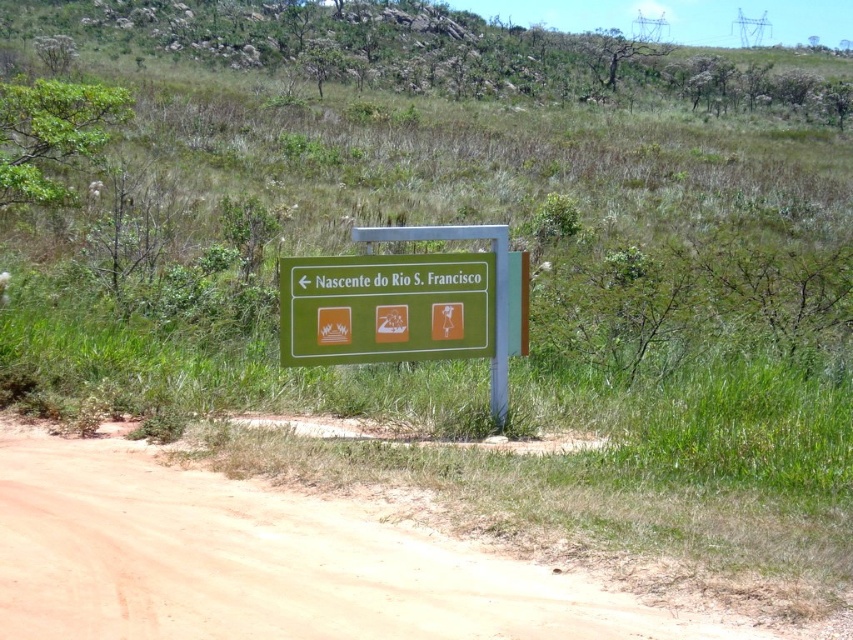
Question: Which object is the farthest from the green matte sign at center?

Choices:
 (A) green plastic sign at center
 (B) brown sandy dirt track at lower left

Answer: (B)

Question: Is brown sandy dirt track at lower left above green plastic sign at center?

Choices:
 (A) yes
 (B) no

Answer: (B)

Question: Can you confirm if brown sandy dirt track at lower left is positioned below green plastic sign at center?

Choices:
 (A) yes
 (B) no

Answer: (A)

Question: Which point appears farthest from the camera in this image?

Choices:
 (A) (297, 276)
 (B) (422, 289)

Answer: (B)

Question: Is green plastic sign at center bigger than green matte sign at center?

Choices:
 (A) yes
 (B) no

Answer: (A)

Question: Based on their relative distances, which object is nearer to the brown sandy dirt track at lower left?

Choices:
 (A) green plastic sign at center
 (B) green matte sign at center

Answer: (B)